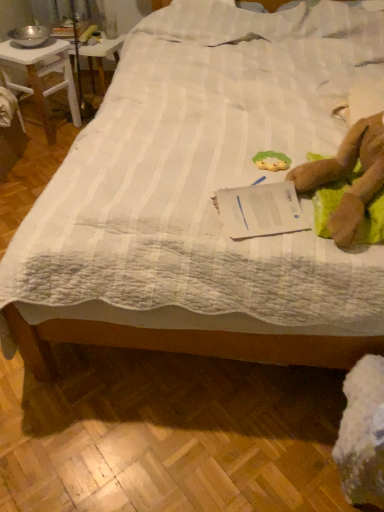
Identify the location of vacant space underneath white wood desk at upper left (from a real-world perspective). (46, 136).